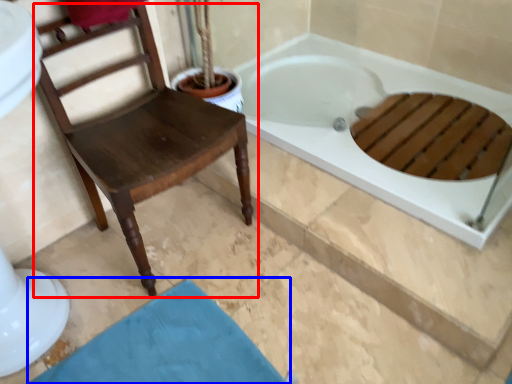
Question: Among these objects, which one is nearest to the camera, chair (highlighted by a red box) or bath mat (highlighted by a blue box)?

Choices:
 (A) chair
 (B) bath mat

Answer: (A)